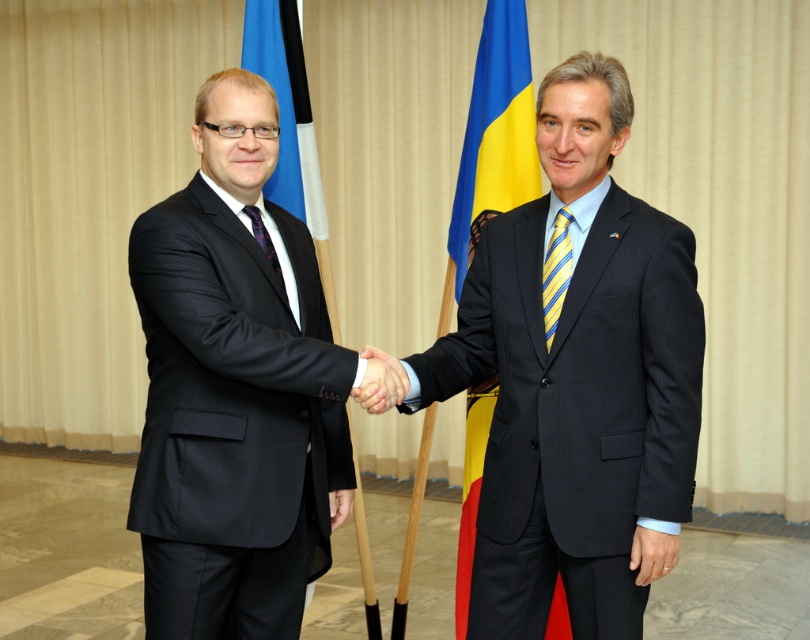
Question: Which point appears farthest from the camera in this image?

Choices:
 (A) (548, 342)
 (B) (224, 620)
 (C) (271, 0)
 (D) (271, 243)

Answer: (C)

Question: Does yellow striped tie at center have a larger size compared to purple satin tie at left?

Choices:
 (A) yes
 (B) no

Answer: (A)

Question: Is black pinstripe suit at left smaller than purple satin tie at left?

Choices:
 (A) yes
 (B) no

Answer: (B)

Question: Estimate the real-world distances between objects in this image. Which object is farther from the purple satin tie at left?

Choices:
 (A) blue fabric flag at left
 (B) matte black hand at center

Answer: (A)

Question: Which object is positioned closest to the yellow striped tie at center?

Choices:
 (A) yellowmaterial/textureflag at right
 (B) purple satin tie at left
 (C) dark pinstripe suit at center

Answer: (C)

Question: Is dark pinstripe suit at center thinner than blue fabric flag at left?

Choices:
 (A) no
 (B) yes

Answer: (A)